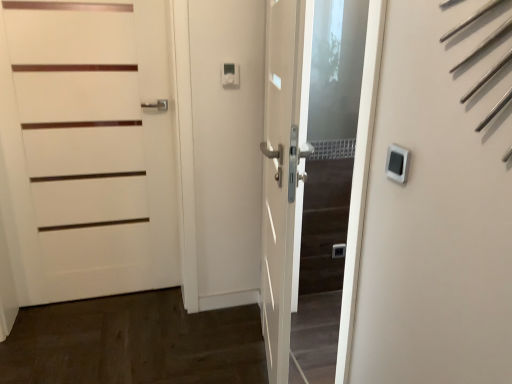
Question: Is white matte door at left, the second door positioned from the right, next to white matte door at center, the second door in the left-to-right sequence?

Choices:
 (A) no
 (B) yes

Answer: (A)

Question: Is white matte door at center, the second door in the left-to-right sequence, at the back of white matte door at left, the 1th door from the left?

Choices:
 (A) no
 (B) yes

Answer: (A)

Question: Does white matte door at left, the second door positioned from the right, come in front of white matte door at center, the 1th door positioned from the right?

Choices:
 (A) yes
 (B) no

Answer: (B)

Question: From the image's perspective, would you say white matte door at left, the 1th door from the left, is shown under white matte door at center, the second door in the left-to-right sequence?

Choices:
 (A) yes
 (B) no

Answer: (B)

Question: Can you confirm if white matte door at left, the second door positioned from the right, is positioned to the left of white matte door at center, the second door in the left-to-right sequence?

Choices:
 (A) yes
 (B) no

Answer: (A)

Question: Considering the positions of white matte door at left, the 1th door from the left, and white matte door at center in the image, is white matte door at left, the 1th door from the left, wider or thinner than white matte door at center?

Choices:
 (A) thin
 (B) wide

Answer: (A)

Question: From the image's perspective, is white matte door at left, the 1th door from the left, positioned above or below white matte door at center?

Choices:
 (A) below
 (B) above

Answer: (B)

Question: Based on their positions, is white matte door at left, the 1th door from the left, located to the left or right of white matte door at center?

Choices:
 (A) right
 (B) left

Answer: (B)

Question: Is white matte door at left, the 1th door from the left, bigger or smaller than white matte door at center?

Choices:
 (A) big
 (B) small

Answer: (B)

Question: Is white matte door at center bigger or smaller than white matte door at center, the second door in the left-to-right sequence?

Choices:
 (A) big
 (B) small

Answer: (B)

Question: In the image, is white matte door at center on the left side or the right side of white matte door at center, the 1th door positioned from the right?

Choices:
 (A) right
 (B) left

Answer: (B)

Question: Is point (243, 79) closer or farther from the camera than point (281, 117)?

Choices:
 (A) closer
 (B) farther

Answer: (B)

Question: Looking at their shapes, would you say white matte door at center is wider or thinner than white matte door at center, the 1th door positioned from the right?

Choices:
 (A) thin
 (B) wide

Answer: (A)

Question: In terms of width, does white matte door at center, the second door in the left-to-right sequence, look wider or thinner when compared to white plastic thermostat at upper right?

Choices:
 (A) wide
 (B) thin

Answer: (A)

Question: Is white matte door at center, the 1th door positioned from the right, in front of or behind white plastic thermostat at upper right in the image?

Choices:
 (A) front
 (B) behind

Answer: (B)